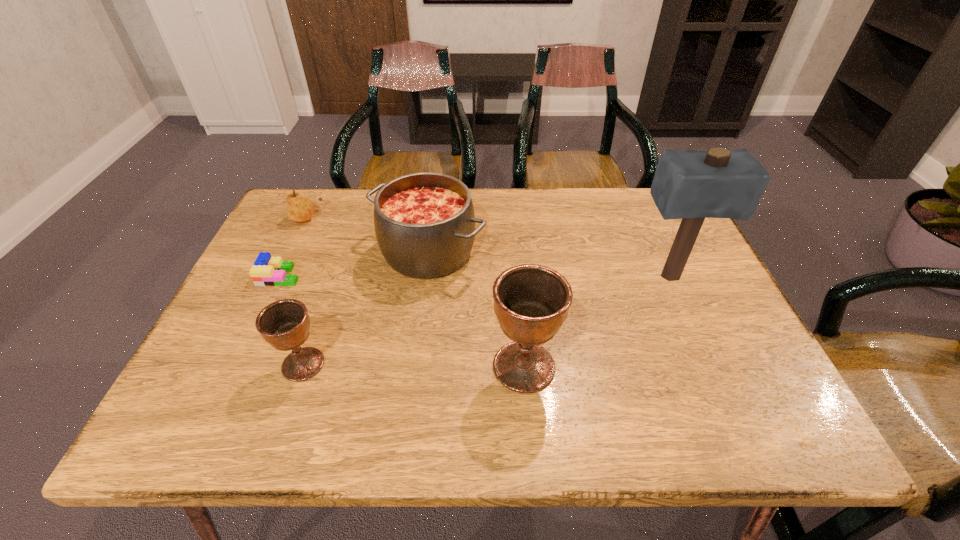
I want to click on free space between the shortest object and the rightmost object, so click(x=474, y=276).

Locate an element on the screen. The width and height of the screenshot is (960, 540). free spot between the pear and the left chalice is located at coordinates 304,291.

Image resolution: width=960 pixels, height=540 pixels. I want to click on vacant space that is in between the tallest object and the shortest object, so click(x=474, y=276).

Identify the location of free spot between the left chalice and the casserole. The width and height of the screenshot is (960, 540). (366, 308).

The image size is (960, 540). I want to click on free space that is in between the fifth shortest object and the shorter chalice, so click(x=414, y=366).

I want to click on free spot between the second object from right to left and the second shortest object, so click(415, 292).

Select which object is the second closest to the casserole. Please provide its 2D coordinates. Your answer should be formatted as a tuple, i.e. [(x, y)], where the tuple contains the x and y coordinates of a point satisfying the conditions above.

[(531, 302)]

Choose which object is the fifth nearest neighbor to the taller chalice. Please provide its 2D coordinates. Your answer should be formatted as a tuple, i.e. [(x, y)], where the tuple contains the x and y coordinates of a point satisfying the conditions above.

[(299, 208)]

Find the location of a particular element. The width and height of the screenshot is (960, 540). vacant space that satisfies the following two spatial constraints: 1. on the front side of the tallest object; 2. on the left side of the pear is located at coordinates (278, 276).

Find the location of a particular element. The width and height of the screenshot is (960, 540). free location that satisfies the following two spatial constraints: 1. on the front side of the second shortest object; 2. on the left side of the third object from right to left is located at coordinates (291, 252).